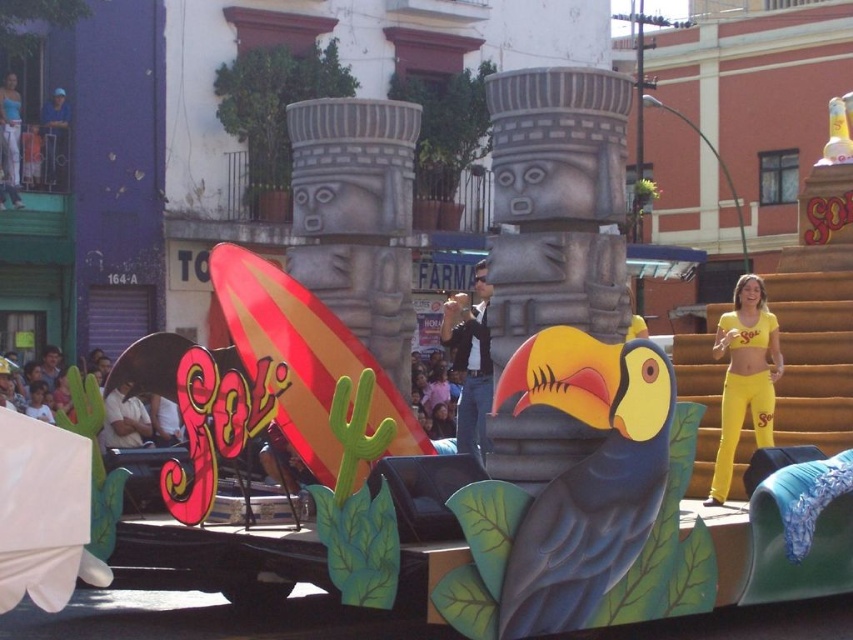
Question: Considering the real-world distances, which object is farthest from the yellow matte/yellow fabric at right?

Choices:
 (A) denim jeans at center
 (B) matte blue toucan at center

Answer: (B)

Question: Where is matte blue toucan at center located in relation to yellow matte/yellow fabric at right in the image?

Choices:
 (A) below
 (B) above

Answer: (A)

Question: Which point is closer to the camera taking this photo?

Choices:
 (A) (537, 589)
 (B) (442, 337)
 (C) (723, 333)

Answer: (A)

Question: Which point appears farthest from the camera in this image?

Choices:
 (A) (624, 573)
 (B) (485, 397)

Answer: (B)

Question: Does matte blue toucan at center have a lesser width compared to denim jeans at center?

Choices:
 (A) yes
 (B) no

Answer: (B)

Question: Does matte blue toucan at center appear on the left side of yellow matte/yellow fabric at right?

Choices:
 (A) no
 (B) yes

Answer: (B)